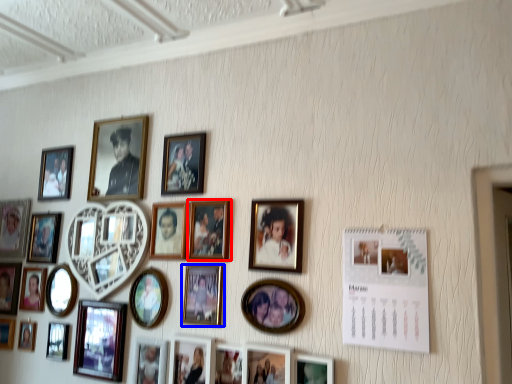
Question: Which of the following is the farthest to the observer, picture frame (highlighted by a red box) or picture frame (highlighted by a blue box)?

Choices:
 (A) picture frame
 (B) picture frame

Answer: (A)